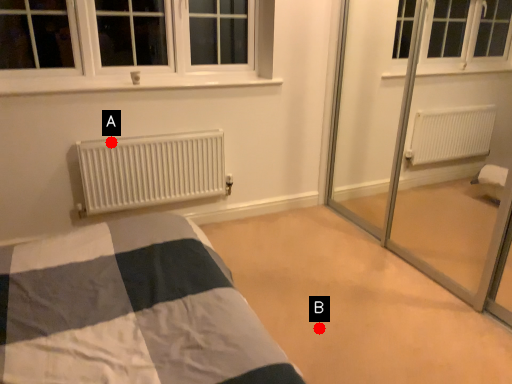
Question: Two points are circled on the image, labeled by A and B beside each circle. Which of the following is the farthest from the observer?

Choices:
 (A) A is further
 (B) B is further

Answer: (A)